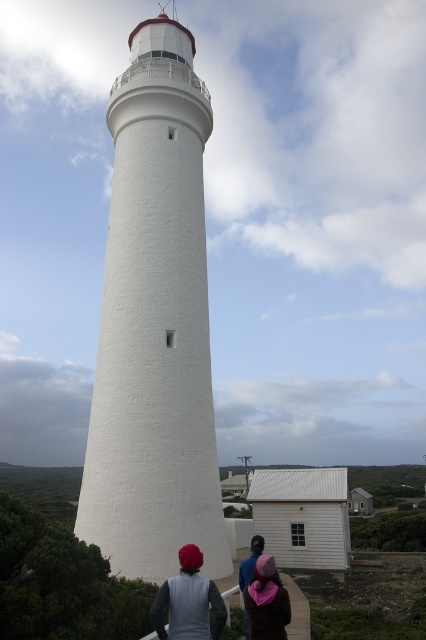
Question: Is the position of pink fabric at lower center more distant than that of pink fabric hat at lower center?

Choices:
 (A) no
 (B) yes

Answer: (A)

Question: Can you confirm if white textured lighthouse at center is positioned to the left of pink fabric at lower center?

Choices:
 (A) no
 (B) yes

Answer: (B)

Question: Which of the following is the closest to the observer?

Choices:
 (A) white textured lighthouse at center
 (B) pink fabric at lower center

Answer: (B)

Question: Which point appears closest to the camera in this image?

Choices:
 (A) (115, 243)
 (B) (284, 627)
 (C) (206, 600)

Answer: (C)

Question: Among these points, which one is nearest to the camera?

Choices:
 (A) (187, 300)
 (B) (262, 621)

Answer: (B)

Question: Can you confirm if white textured lighthouse at center is positioned below pink fabric at lower center?

Choices:
 (A) no
 (B) yes

Answer: (A)